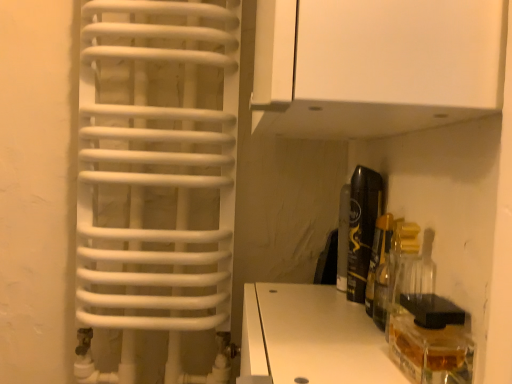
Question: Considering the positions of point (394, 258) and point (370, 187), is point (394, 258) closer or farther from the camera than point (370, 187)?

Choices:
 (A) closer
 (B) farther

Answer: (A)

Question: Is clear glass bottle at center right, acting as the 2th bottle starting from the back, in front of or behind black glossy can at right, which appears as the 1th bottle when viewed from the back, in the image?

Choices:
 (A) behind
 (B) front

Answer: (B)

Question: Considering the real-world distances, which object is farthest from the clear glass bottle at center right, acting as the 2th bottle starting from the back?

Choices:
 (A) black glossy can at right, the 2th bottle positioned from the front
 (B) white matte cabinet at upper center

Answer: (B)

Question: Estimate the real-world distances between objects in this image. Which object is farther from the black glossy can at right, which appears as the 1th bottle when viewed from the back?

Choices:
 (A) clear glass bottle at center right, acting as the 2th bottle starting from the back
 (B) white matte cabinet at upper center

Answer: (B)